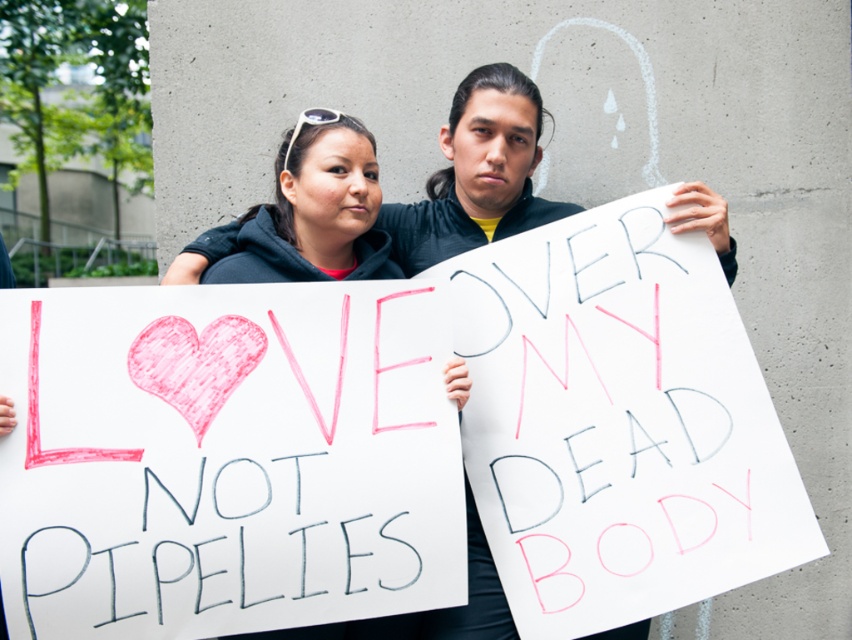
You are a photographer trying to capture both the matte black jacket at center and the matte black hoodie at center in a single frame. Since they are both centered, will the jacket block the view of the hoodie?

The matte black jacket at center is positioned over the matte black hoodie at center, so yes, the jacket will block the view of the hoodie in the photo.

You are a photographer trying to capture the protest scene. You want to ensure the matte black jacket at center is in focus. Where should you position your camera to capture it clearly?

Position your camera at the point where the matte black jacket at center is located, which is at coordinates (476, 173), to ensure it is in focus.

You are a photographer trying to capture both the matte black jacket at center and the matte black hoodie at center in a single frame. Since they are both at the center, which one is positioned to the right side of the other?

The matte black jacket at center is to the right of the matte black hoodie at center, so the jacket is on the right side.